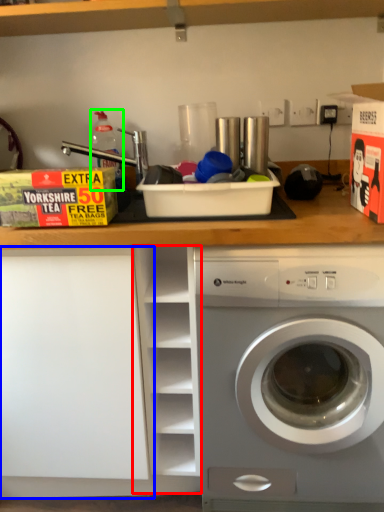
Question: Which object is the closest to the cabinet (highlighted by a red box)? Choose among these: shelf (highlighted by a blue box) or bottle (highlighted by a green box).

Choices:
 (A) shelf
 (B) bottle

Answer: (A)